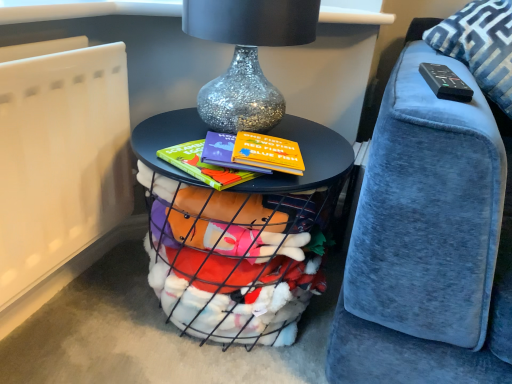
Locate an element on the screen. blue velvet pillow at upper right is located at coordinates (480, 46).

Locate an element on the screen. glittery silver glass table lamp at center is located at coordinates (247, 56).

Where is `blue velvet pillow at upper right`? This screenshot has height=384, width=512. blue velvet pillow at upper right is located at coordinates pos(480,46).

From the image's perspective, is metallic wire basket at center on top of glittery silver glass table lamp at center?

No, from the image's perspective, metallic wire basket at center is not over glittery silver glass table lamp at center.

Which of these two, metallic wire basket at center or glittery silver glass table lamp at center, is smaller?

glittery silver glass table lamp at center.

Is metallic wire basket at center wider than glittery silver glass table lamp at center?

Yes, metallic wire basket at center is wider than glittery silver glass table lamp at center.

This screenshot has width=512, height=384. Identify the location of table below the glittery silver glass table lamp at center (from a real-world perspective). (234, 235).

Which object is positioned more to the left, blue velvet pillow at upper right or black plastic remote at upper right?

Positioned to the left is black plastic remote at upper right.

Is blue velvet pillow at upper right directly adjacent to black plastic remote at upper right?

No, blue velvet pillow at upper right is not touching black plastic remote at upper right.

Is the position of blue velvet pillow at upper right more distant than that of black plastic remote at upper right?

Yes.

Is blue velvet pillow at upper right thinner than black plastic remote at upper right?

No, blue velvet pillow at upper right is not thinner than black plastic remote at upper right.

Does white matte radiator at lower left have a lesser width compared to blue velvet pillow at upper right?

Indeed, white matte radiator at lower left has a lesser width compared to blue velvet pillow at upper right.

Measure the distance between white matte radiator at lower left and blue velvet pillow at upper right.

A distance of 33.20 inches exists between white matte radiator at lower left and blue velvet pillow at upper right.

From their relative heights in the image, would you say white matte radiator at lower left is taller or shorter than blue velvet pillow at upper right?

Considering their sizes, white matte radiator at lower left has more height than blue velvet pillow at upper right.

This screenshot has width=512, height=384. I want to click on pillow lying behind the white matte radiator at lower left, so click(480, 46).

Consider the image. Is the position of glittery silver glass table lamp at center less distant than that of blue velvet pillow at upper right?

Yes, it is.

Is glittery silver glass table lamp at center inside or outside of blue velvet pillow at upper right?

glittery silver glass table lamp at center exists outside the volume of blue velvet pillow at upper right.

Considering the relative sizes of glittery silver glass table lamp at center and blue velvet pillow at upper right in the image provided, is glittery silver glass table lamp at center smaller than blue velvet pillow at upper right?

Indeed, glittery silver glass table lamp at center has a smaller size compared to blue velvet pillow at upper right.

Is glittery silver glass table lamp at center positioned with its back to blue velvet pillow at upper right?

glittery silver glass table lamp at center is not turned away from blue velvet pillow at upper right.

Is black plastic remote at upper right turned away from metallic wire basket at center?

No, metallic wire basket at center is not at the back of black plastic remote at upper right.

Is point (443, 79) closer to camera compared to point (251, 335)?

Yes.

Is black plastic remote at upper right to the left of metallic wire basket at center from the viewer's perspective?

No.

Would you say black plastic remote at upper right is a long distance from metallic wire basket at center?

That's not correct — black plastic remote at upper right is a little close to metallic wire basket at center.

Is blue velvet pillow at upper right a part of metallic wire basket at center?

No, blue velvet pillow at upper right is not a part of metallic wire basket at center.

From the image's perspective, would you say metallic wire basket at center is shown under blue velvet pillow at upper right?

Indeed, from the image's perspective, metallic wire basket at center is shown beneath blue velvet pillow at upper right.

Consider the image. Can you confirm if metallic wire basket at center is positioned to the right of blue velvet pillow at upper right?

Incorrect, metallic wire basket at center is not on the right side of blue velvet pillow at upper right.

Is metallic wire basket at center beside blue velvet pillow at upper right?

No.

Does white matte radiator at lower left appear on the right side of black plastic remote at upper right?

In fact, white matte radiator at lower left is to the left of black plastic remote at upper right.

Considering the relative sizes of white matte radiator at lower left and black plastic remote at upper right in the image provided, is white matte radiator at lower left bigger than black plastic remote at upper right?

Indeed, white matte radiator at lower left has a larger size compared to black plastic remote at upper right.

Is white matte radiator at lower left turned away from black plastic remote at upper right?

No, white matte radiator at lower left is not facing the opposite direction of black plastic remote at upper right.

The image size is (512, 384). In order to click on radiator below the black plastic remote at upper right (from the image's perspective) in this screenshot , I will do `click(60, 155)`.

Locate an element on the screen. This screenshot has width=512, height=384. table below the glittery silver glass table lamp at center (from the image's perspective) is located at coordinates (234, 235).

This screenshot has height=384, width=512. In the image, there is a black plastic remote at upper right. In order to click on pillow below it (from a real-world perspective) in this screenshot , I will do `click(480, 46)`.

Looking at the image, which one is located closer to metallic wire basket at center, white matte radiator at lower left or glittery silver glass table lamp at center?

glittery silver glass table lamp at center lies closer to metallic wire basket at center than the other object.

When comparing their distances from blue velvet pillow at upper right, does metallic wire basket at center or glittery silver glass table lamp at center seem closer?

glittery silver glass table lamp at center is positioned closer to the anchor blue velvet pillow at upper right.

Considering their positions, is white matte radiator at lower left positioned further to glittery silver glass table lamp at center than black plastic remote at upper right?

black plastic remote at upper right is further to glittery silver glass table lamp at center.

From the image, which object appears to be farther from black plastic remote at upper right, blue velvet pillow at upper right or glittery silver glass table lamp at center?

Among the two, glittery silver glass table lamp at center is located further to black plastic remote at upper right.

Which object lies further to the anchor point glittery silver glass table lamp at center, black plastic remote at upper right or metallic wire basket at center?

Among the two, black plastic remote at upper right is located further to glittery silver glass table lamp at center.

When comparing their distances from white matte radiator at lower left, does glittery silver glass table lamp at center or blue velvet pillow at upper right seem closer?

Based on the image, glittery silver glass table lamp at center appears to be nearer to white matte radiator at lower left.

Estimate the real-world distances between objects in this image. Which object is further from metallic wire basket at center, blue velvet pillow at upper right or black plastic remote at upper right?

blue velvet pillow at upper right is further to metallic wire basket at center.

From the image, which object appears to be farther from blue velvet pillow at upper right, white matte radiator at lower left or glittery silver glass table lamp at center?

Among the two, white matte radiator at lower left is located further to blue velvet pillow at upper right.

Where is `table between white matte radiator at lower left and black plastic remote at upper right from left to right`? This screenshot has width=512, height=384. table between white matte radiator at lower left and black plastic remote at upper right from left to right is located at coordinates (234, 235).

Where is `table located between white matte radiator at lower left and blue velvet pillow at upper right in the left-right direction`? This screenshot has width=512, height=384. table located between white matte radiator at lower left and blue velvet pillow at upper right in the left-right direction is located at coordinates (234, 235).

Locate an element on the screen. The width and height of the screenshot is (512, 384). table lamp located between metallic wire basket at center and black plastic remote at upper right in the left-right direction is located at coordinates (247, 56).

The width and height of the screenshot is (512, 384). What are the coordinates of `table lamp between metallic wire basket at center and blue velvet pillow at upper right in the horizontal direction` in the screenshot? It's located at (247, 56).